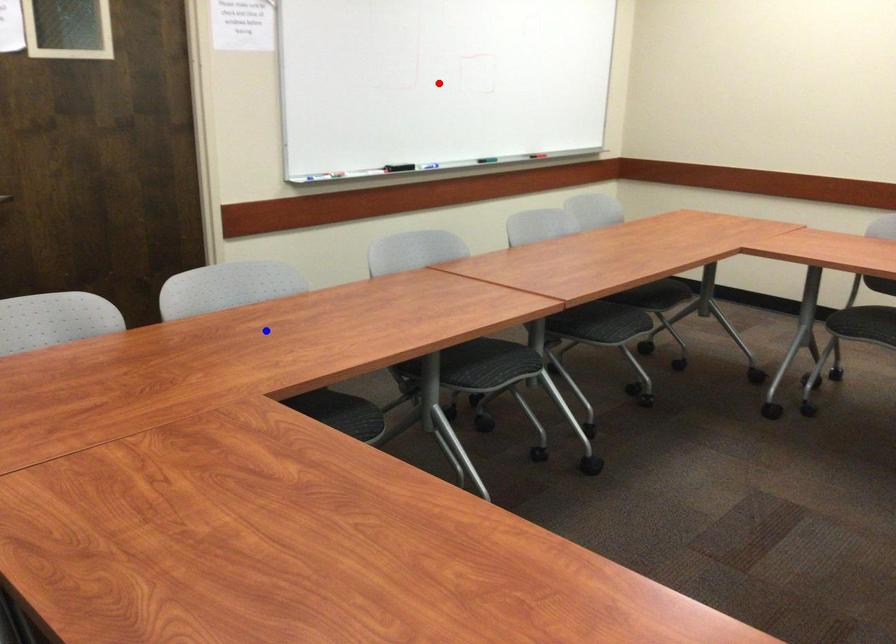
Question: In the image, two points are highlighted. Which point is nearer to the camera? Reply with the corresponding letter.

Choices:
 (A) blue point
 (B) red point

Answer: (A)